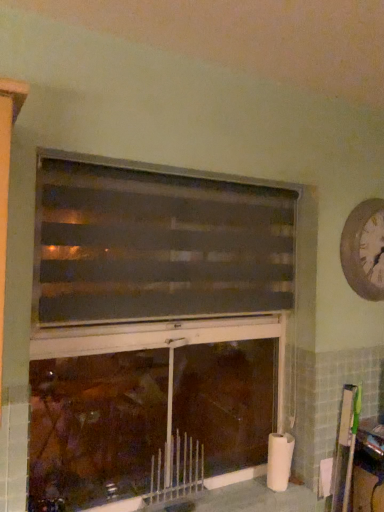
The image size is (384, 512). What do you see at coordinates (364, 249) in the screenshot?
I see `white textured clock at upper right` at bounding box center [364, 249].

This screenshot has height=512, width=384. What do you see at coordinates (176, 470) in the screenshot?
I see `metallic silver radiator at lower center` at bounding box center [176, 470].

The height and width of the screenshot is (512, 384). What do you see at coordinates (345, 447) in the screenshot?
I see `wooden bulletin board at right` at bounding box center [345, 447].

The width and height of the screenshot is (384, 512). Find the location of `white textured clock at upper right`. white textured clock at upper right is located at coordinates (364, 249).

From the image's perspective, who appears lower, wooden bulletin board at right or matte brown fireplace at center?

wooden bulletin board at right.

Considering the sizes of wooden bulletin board at right and matte brown fireplace at center in the image, is wooden bulletin board at right taller or shorter than matte brown fireplace at center?

In the image, wooden bulletin board at right appears to be shorter than matte brown fireplace at center.

Looking at this image, which object is further away from the camera taking this photo, wooden bulletin board at right or matte brown fireplace at center?

wooden bulletin board at right is behind.

Is wooden bulletin board at right facing away from matte brown fireplace at center?

No, wooden bulletin board at right's orientation is not away from matte brown fireplace at center.

Considering the relative sizes of white textured clock at upper right and dark brown textured blinds at center in the image provided, is white textured clock at upper right shorter than dark brown textured blinds at center?

Indeed, white textured clock at upper right has a lesser height compared to dark brown textured blinds at center.

Is white textured clock at upper right positioned in front of dark brown textured blinds at center?

No, white textured clock at upper right is further to the viewer.

Considering the positions of objects white textured clock at upper right and dark brown textured blinds at center in the image provided, who is more to the right, white textured clock at upper right or dark brown textured blinds at center?

Positioned to the right is white textured clock at upper right.

Is white textured clock at upper right far away from dark brown textured blinds at center?

No, white textured clock at upper right is not far away from dark brown textured blinds at center.

Is metallic silver radiator at lower center to the left of wooden bulletin board at right from the viewer's perspective?

Yes.

Is metallic silver radiator at lower center positioned with its back to wooden bulletin board at right?

No.

Relative to wooden bulletin board at right, is metallic silver radiator at lower center in front or behind?

metallic silver radiator at lower center is in front of wooden bulletin board at right.

Who is taller, dark brown textured blinds at center or white textured clock at upper right?

With more height is dark brown textured blinds at center.

Can you tell me how much dark brown textured blinds at center and white textured clock at upper right differ in facing direction?

There is a 0.00209-degree angle between the facing directions of dark brown textured blinds at center and white textured clock at upper right.

From the image's perspective, is dark brown textured blinds at center positioned above or below white textured clock at upper right?

Clearly, from the image's perspective, dark brown textured blinds at center is below white textured clock at upper right.

Can you confirm if dark brown textured blinds at center is wider than white textured clock at upper right?

Correct, the width of dark brown textured blinds at center exceeds that of white textured clock at upper right.

From the image's perspective, is matte brown fireplace at center on top of white textured clock at upper right?

No, from the image's perspective, matte brown fireplace at center is not over white textured clock at upper right.

Does matte brown fireplace at center have a lesser height compared to white textured clock at upper right?

No.

Who is smaller, matte brown fireplace at center or white textured clock at upper right?

With smaller size is white textured clock at upper right.

Is matte brown fireplace at center not within white textured clock at upper right?

matte brown fireplace at center is positioned outside white textured clock at upper right.

From the image's perspective, is dark brown textured blinds at center above matte brown fireplace at center?

Correct, dark brown textured blinds at center appears higher than matte brown fireplace at center in the image.

From a real-world perspective, is dark brown textured blinds at center positioned above or below matte brown fireplace at center?

dark brown textured blinds at center is situated higher than matte brown fireplace at center in the real world.

Based on the photo, how different are the orientations of dark brown textured blinds at center and matte brown fireplace at center in degrees?

The angle between the facing direction of dark brown textured blinds at center and the facing direction of matte brown fireplace at center is 0.00143 degrees.

Considering the sizes of dark brown textured blinds at center and matte brown fireplace at center in the image, is dark brown textured blinds at center wider or thinner than matte brown fireplace at center?

Clearly, dark brown textured blinds at center has more width compared to matte brown fireplace at center.

From the picture: From a real-world perspective, which object rests below the other?

matte brown fireplace at center is physically lower.

From the image's perspective, relative to matte brown fireplace at center, is white textured clock at upper right above or below?

white textured clock at upper right is above matte brown fireplace at center.

Is white textured clock at upper right facing towards matte brown fireplace at center?

No.

How distant is white textured clock at upper right from matte brown fireplace at center?

A distance of 26.39 inches exists between white textured clock at upper right and matte brown fireplace at center.

At what (x,y) coordinates should I click in order to perform the action: click on bulletin board that appears on the right of matte brown fireplace at center. Please return your answer as a coordinate pair (x, y). The image size is (384, 512). Looking at the image, I should click on (345, 447).

Find the location of a particular element. This screenshot has width=384, height=512. clock that appears above the dark brown textured blinds at center (from the image's perspective) is located at coordinates (364, 249).

From the image, which object appears to be farther from white textured clock at upper right, metallic silver radiator at lower center or matte brown fireplace at center?

metallic silver radiator at lower center.

Based on their spatial positions, is metallic silver radiator at lower center or dark brown textured blinds at center closer to white textured clock at upper right?

dark brown textured blinds at center is positioned closer to the anchor white textured clock at upper right.

Which object lies nearer to the anchor point metallic silver radiator at lower center, white textured clock at upper right or matte brown fireplace at center?

matte brown fireplace at center is closer to metallic silver radiator at lower center.

Looking at the image, which one is located closer to dark brown textured blinds at center, wooden bulletin board at right or metallic silver radiator at lower center?

metallic silver radiator at lower center is closer to dark brown textured blinds at center.

Which object lies further to the anchor point white textured clock at upper right, wooden bulletin board at right or matte brown fireplace at center?

matte brown fireplace at center is positioned further to the anchor white textured clock at upper right.

Considering their positions, is white textured clock at upper right positioned closer to metallic silver radiator at lower center than wooden bulletin board at right?

wooden bulletin board at right lies closer to metallic silver radiator at lower center than the other object.

Based on their spatial positions, is wooden bulletin board at right or dark brown textured blinds at center closer to metallic silver radiator at lower center?

The object closer to metallic silver radiator at lower center is wooden bulletin board at right.

Based on the photo, estimate the real-world distances between objects in this image. Which object is closer to dark brown textured blinds at center, metallic silver radiator at lower center or wooden bulletin board at right?

metallic silver radiator at lower center lies closer to dark brown textured blinds at center than the other object.

I want to click on radiator between white textured clock at upper right and wooden bulletin board at right in the up-down direction, so click(176, 470).

Find the location of a particular element. radiator between matte brown fireplace at center and wooden bulletin board at right in the horizontal direction is located at coordinates (176, 470).

You are a GUI agent. You are given a task and a screenshot of the screen. Output one action in this format:
    pyautogui.click(x=<x>, y=<y>)
    Task: Click on the fireplace between dark brown textured blinds at center and wooden bulletin board at right from top to bottom
    
    Given the screenshot: What is the action you would take?
    pyautogui.click(x=156, y=328)

Identify the location of radiator located between matte brown fireplace at center and white textured clock at upper right in the left-right direction. (176, 470).